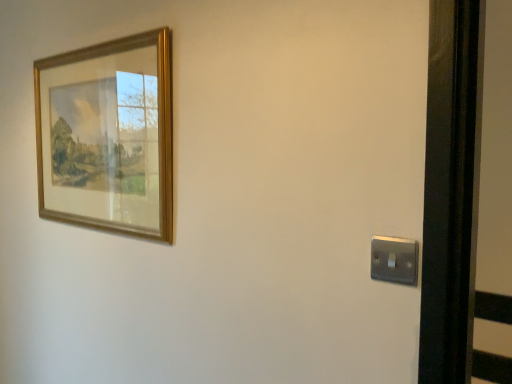
Question: Do you think wooden picture frame at upper left is within satin silver switch at lower right, or outside of it?

Choices:
 (A) inside
 (B) outside

Answer: (B)

Question: From their relative heights in the image, would you say wooden picture frame at upper left is taller or shorter than satin silver switch at lower right?

Choices:
 (A) short
 (B) tall

Answer: (B)

Question: Does point (147, 104) appear closer or farther from the camera than point (379, 256)?

Choices:
 (A) farther
 (B) closer

Answer: (A)

Question: Does point (373, 246) appear closer or farther from the camera than point (128, 49)?

Choices:
 (A) farther
 (B) closer

Answer: (B)

Question: From the image's perspective, is satin silver switch at lower right located above or below wooden picture frame at upper left?

Choices:
 (A) below
 (B) above

Answer: (A)

Question: Based on their sizes in the image, would you say satin silver switch at lower right is bigger or smaller than wooden picture frame at upper left?

Choices:
 (A) big
 (B) small

Answer: (B)

Question: Relative to wooden picture frame at upper left, is satin silver switch at lower right in front or behind?

Choices:
 (A) front
 (B) behind

Answer: (A)